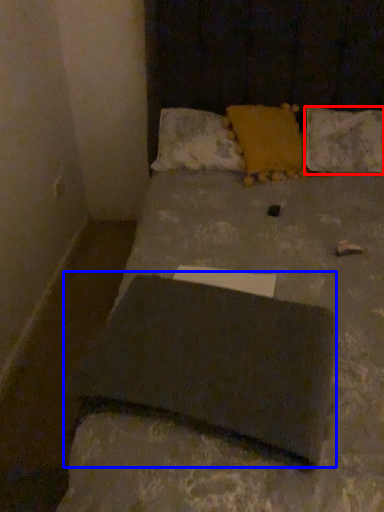
Question: Which object appears farthest to the camera in this image, pillow (highlighted by a red box) or slate (highlighted by a blue box)?

Choices:
 (A) pillow
 (B) slate

Answer: (A)